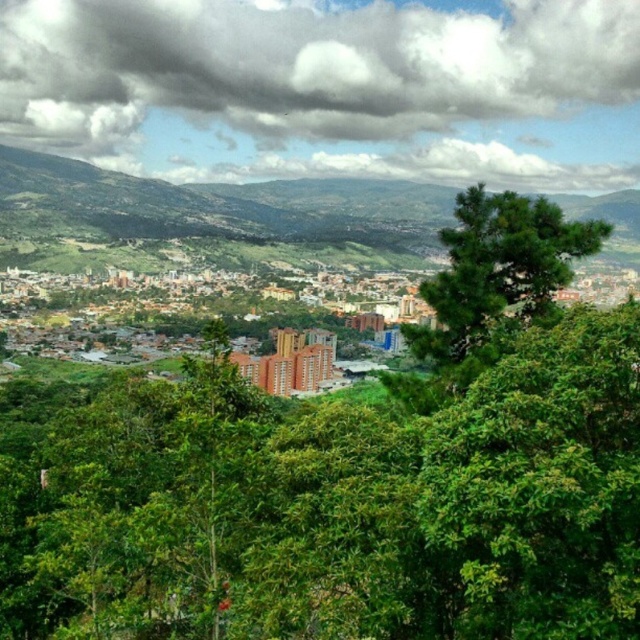
Is green leafy tree at center to the left of cloudy sky at upper center from the viewer's perspective?

No, green leafy tree at center is not to the left of cloudy sky at upper center.

Does green leafy tree at center appear on the right side of cloudy sky at upper center?

Yes, green leafy tree at center is to the right of cloudy sky at upper center.

Locate an element on the screen. green leafy tree at center is located at coordinates (339, 508).

Who is higher up, cloudy sky at upper center or brown brick buildings at center?

cloudy sky at upper center

Based on the photo, which of these two, cloudy sky at upper center or brown brick buildings at center, stands taller?

With more height is cloudy sky at upper center.

Is point (64, 83) farther from viewer compared to point (273, 312)?

That is True.

Find the location of `cloudy sky at upper center`. cloudy sky at upper center is located at coordinates (330, 88).

Describe the element at coordinates (339, 508) in the screenshot. This screenshot has width=640, height=640. I see `green leafy tree at center` at that location.

Between green leafy tree at center and green leafy tree at center-right, which one is positioned higher?

green leafy tree at center-right is above.

Identify the location of green leafy tree at center. The height and width of the screenshot is (640, 640). (339, 508).

I want to click on green leafy tree at center, so click(x=339, y=508).